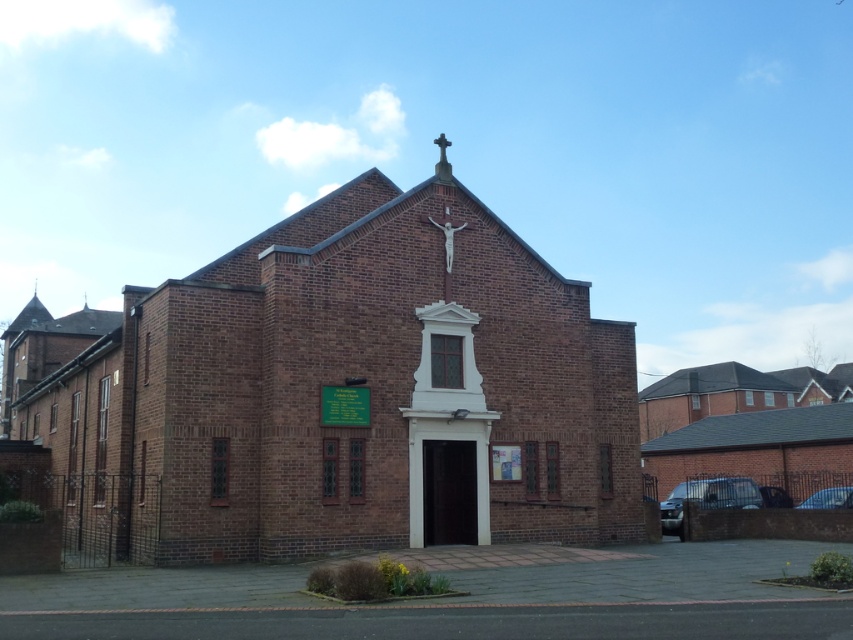
Question: Which of these objects is positioned farthest from the brown brick church at center?

Choices:
 (A) blue metallic car at lower right
 (B) metallic crucifix at center
 (C) metallic silver car at lower right

Answer: (A)

Question: Does metallic silver car at lower right have a greater width compared to metallic crucifix at center?

Choices:
 (A) yes
 (B) no

Answer: (A)

Question: Which is nearer to the blue metallic car at lower right?

Choices:
 (A) brown brick church at center
 (B) metallic crucifix at center
 (C) metallic silver car at lower right

Answer: (C)

Question: Does brown brick church at center have a greater width compared to blue metallic car at lower right?

Choices:
 (A) yes
 (B) no

Answer: (A)

Question: Is brown brick church at center smaller than metallic crucifix at center?

Choices:
 (A) no
 (B) yes

Answer: (A)

Question: Which point is farther to the camera?

Choices:
 (A) (663, 529)
 (B) (825, 488)
 (C) (451, 250)

Answer: (B)